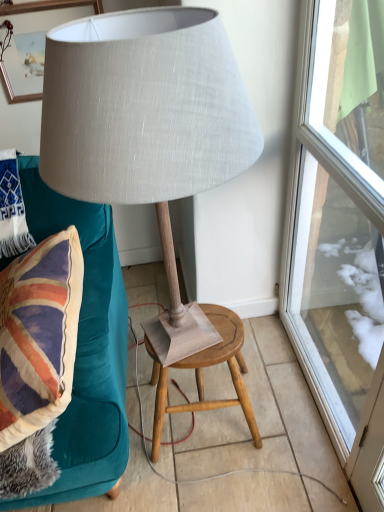
Question: Is matte gray fabric lamp at center taller than wooden stool at center?

Choices:
 (A) yes
 (B) no

Answer: (A)

Question: Considering the relative sizes of matte gray fabric lamp at center and wooden stool at center in the image provided, is matte gray fabric lamp at center bigger than wooden stool at center?

Choices:
 (A) no
 (B) yes

Answer: (B)

Question: Is matte gray fabric lamp at center looking in the opposite direction of wooden stool at center?

Choices:
 (A) yes
 (B) no

Answer: (B)

Question: Is matte gray fabric lamp at center to the left of wooden stool at center from the viewer's perspective?

Choices:
 (A) no
 (B) yes

Answer: (B)

Question: From the image's perspective, would you say matte gray fabric lamp at center is shown under wooden stool at center?

Choices:
 (A) yes
 (B) no

Answer: (B)

Question: In the image, is transparent glass door at right positioned in front of or behind wooden stool at center?

Choices:
 (A) front
 (B) behind

Answer: (A)

Question: From a real-world perspective, is transparent glass door at right above or below wooden stool at center?

Choices:
 (A) above
 (B) below

Answer: (A)

Question: Considering the positions of point (339, 41) and point (160, 375), is point (339, 41) closer or farther from the camera than point (160, 375)?

Choices:
 (A) closer
 (B) farther

Answer: (A)

Question: Visually, is transparent glass door at right positioned to the left or to the right of wooden stool at center?

Choices:
 (A) right
 (B) left

Answer: (A)

Question: Is white woven pillow at upper left situated inside wooden stool at center or outside?

Choices:
 (A) outside
 (B) inside

Answer: (A)

Question: Considering the positions of white woven pillow at upper left and wooden stool at center in the image, is white woven pillow at upper left bigger or smaller than wooden stool at center?

Choices:
 (A) big
 (B) small

Answer: (B)

Question: Considering the positions of point (1, 174) and point (256, 440), is point (1, 174) closer or farther from the camera than point (256, 440)?

Choices:
 (A) farther
 (B) closer

Answer: (B)

Question: Is white woven pillow at upper left in front of or behind wooden stool at center in the image?

Choices:
 (A) behind
 (B) front

Answer: (A)

Question: In the image, is matte gray fabric lamp at center positioned in front of or behind wooden stool at center?

Choices:
 (A) behind
 (B) front

Answer: (B)

Question: From a real-world perspective, is matte gray fabric lamp at center above or below wooden stool at center?

Choices:
 (A) below
 (B) above

Answer: (B)